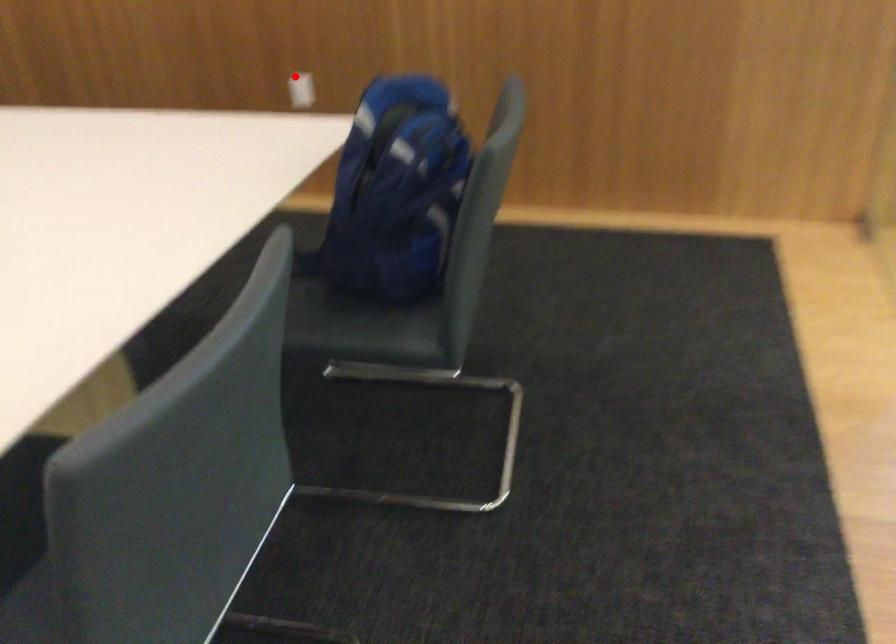
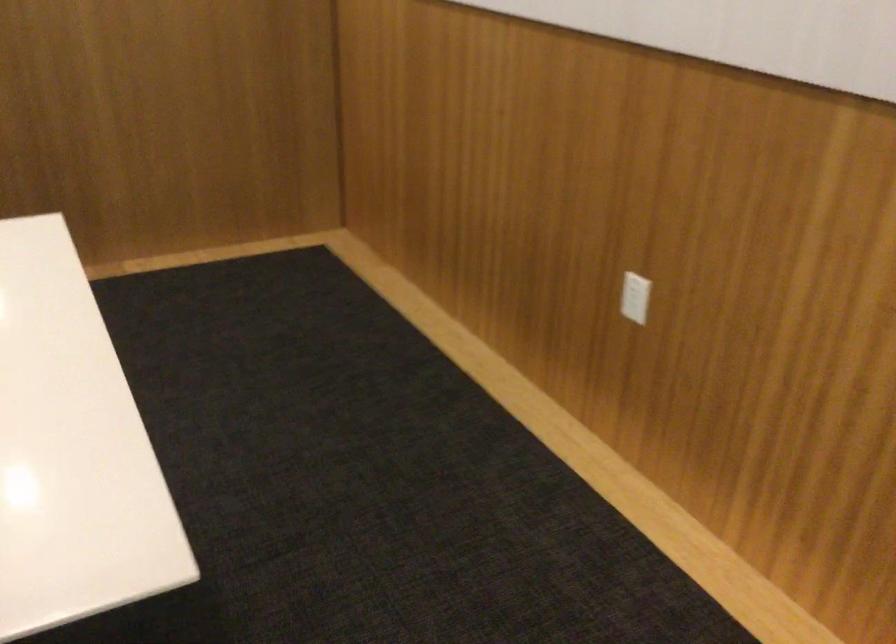
Question: I am providing you with two images of the same scene from different viewpoints. A red point is shown in image1. For the corresponding object point in image2, is it positioned nearer or farther from the camera?

Choices:
 (A) Nearer
 (B) Farther

Answer: (A)